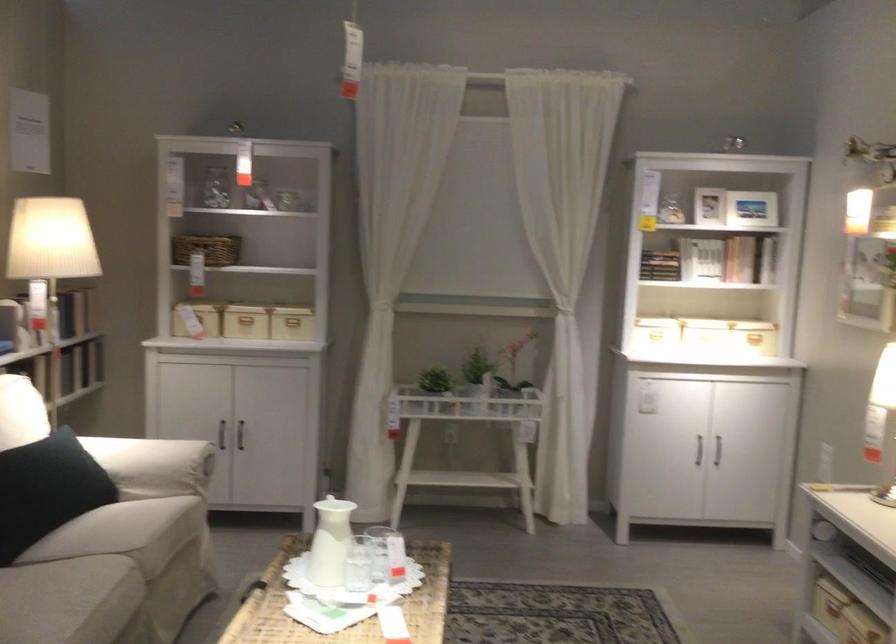
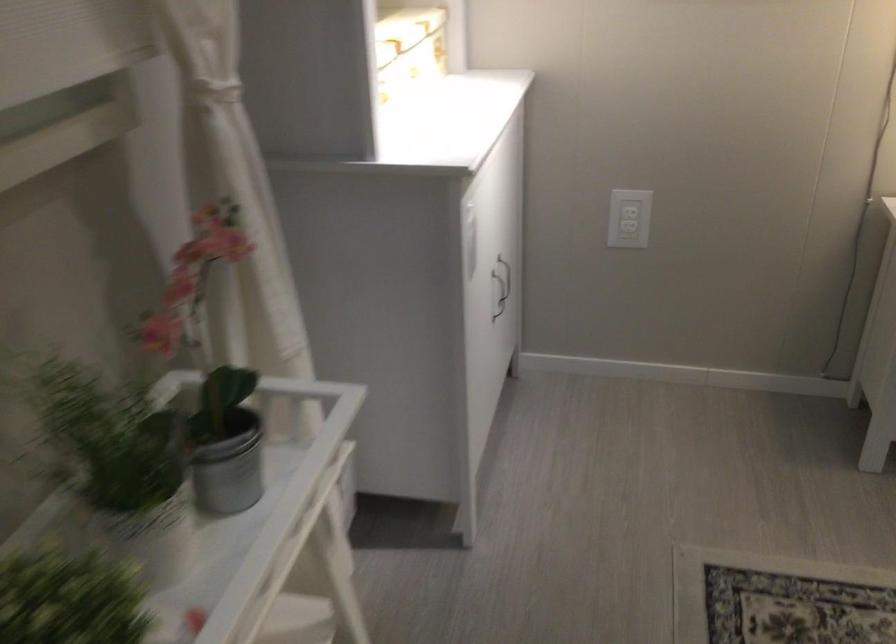
Find the pixel in the second image that matches point 737,313 in the first image.

(410, 44)